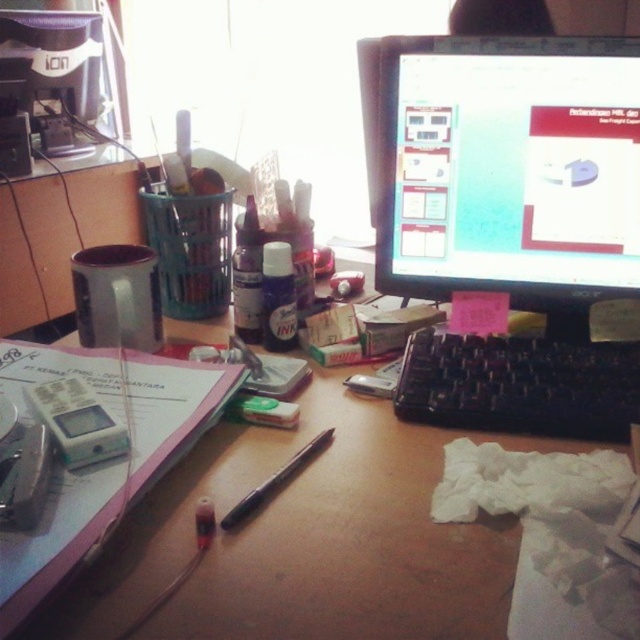
You are organizing the desk and need to place a new item at coordinates point 0.6, 0.1. Is there enough space near the white plastic calculator at left to place this new item?

The white plastic calculator at left is at point (77, 420). The new item is at (64, 384), which is approximately 0.059 units away in the x and y direction. Depending on the size of the new item and the calculator, there might be space, but the exact distance is about 0.059 units in both directions.

You are a delivery robot that needs to place a package on the desk without blocking the black plastic monitor at center. The package is 12 inches wide. Can you safely place it on the desk while keeping it at least 6 inches away from the monitor?

The black plastic monitor at center is 22.86 inches away from the camera. Since the package is 12 inches wide and needs to be at least 6 inches away from the monitor, there is sufficient space on the desk to place the package without blocking the monitor as long as it is positioned appropriately away from it.

Based on the photo, you are organizing the desk and need to place a new item between the white plastic calculator at left and the matte black pen at center. Based on their current positions, where should you place the new item to ensure it is between them?

The white plastic calculator at left is on the left side of the matte black pen at center, so placing the new item between them would require positioning it to the right of the white plastic calculator at left but to the left of the matte black pen at center.